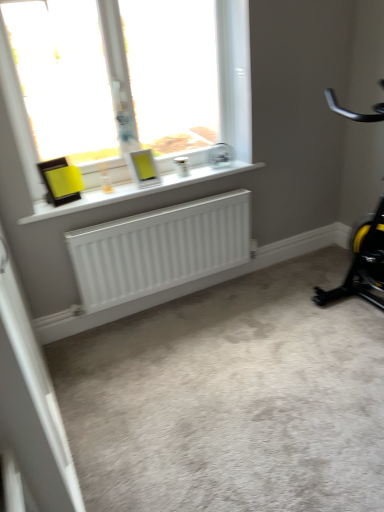
The height and width of the screenshot is (512, 384). Find the location of `white matte radiator at lower center`. white matte radiator at lower center is located at coordinates (136, 190).

This screenshot has height=512, width=384. I want to click on white matte radiator at lower center, so click(x=160, y=249).

The height and width of the screenshot is (512, 384). Describe the element at coordinates (30, 412) in the screenshot. I see `white matte screen door at lower left` at that location.

At what (x,y) coordinates should I click in order to perform the action: click on white matte radiator at lower center. Please return your answer as a coordinate pair (x, y). Looking at the image, I should click on (136, 190).

Is point (73, 134) closer or farther from the camera than point (376, 264)?

Point (73, 134) is closer to the camera than point (376, 264).

Is white plastic window at upper center oriented away from black/yellow plastic stationary bicycle at right?

No, white plastic window at upper center is not facing away from black/yellow plastic stationary bicycle at right.

From the image's perspective, is white plastic window at upper center positioned above or below black/yellow plastic stationary bicycle at right?

Clearly, from the image's perspective, white plastic window at upper center is above black/yellow plastic stationary bicycle at right.

Is white plastic window at upper center in front of or behind black/yellow plastic stationary bicycle at right in the image?

white plastic window at upper center is positioned farther from the viewer than black/yellow plastic stationary bicycle at right.

How far apart are black/yellow plastic stationary bicycle at right and white matte screen door at lower left?

black/yellow plastic stationary bicycle at right and white matte screen door at lower left are 5.28 feet apart from each other.

Is black/yellow plastic stationary bicycle at right to the left of white matte screen door at lower left from the viewer's perspective?

No.

Consider the image. Is white matte screen door at lower left a part of black/yellow plastic stationary bicycle at right?

No, white matte screen door at lower left is located outside of black/yellow plastic stationary bicycle at right.

Considering the relative sizes of black/yellow plastic stationary bicycle at right and white matte screen door at lower left in the image provided, is black/yellow plastic stationary bicycle at right thinner than white matte screen door at lower left?

Incorrect, the width of black/yellow plastic stationary bicycle at right is not less than that of white matte screen door at lower left.

Looking at this image, from the image's perspective, is white plastic window at upper center above or below white matte screen door at lower left?

white plastic window at upper center is above white matte screen door at lower left.

In the scene shown: Which is in front, white plastic window at upper center or white matte screen door at lower left?

Positioned in front is white matte screen door at lower left.

Does white plastic window at upper center contain white matte screen door at lower left?

No, white matte screen door at lower left is not surrounded by white plastic window at upper center.

Can you confirm if black/yellow plastic stationary bicycle at right is positioned to the right of white plastic window at upper center?

Indeed, black/yellow plastic stationary bicycle at right is positioned on the right side of white plastic window at upper center.

What are the coordinates of `stationary bicycle below the white plastic window at upper center (from the image's perspective)` in the screenshot? It's located at (362, 264).

Is black/yellow plastic stationary bicycle at right wider than white plastic window at upper center?

Yes, black/yellow plastic stationary bicycle at right is wider than white plastic window at upper center.

Considering the points (113, 201) and (380, 210), which point is behind, point (113, 201) or point (380, 210)?

The point (380, 210) is more distant.

Looking at this image, can you confirm if white matte radiator at lower center is shorter than black/yellow plastic stationary bicycle at right?

Indeed, white matte radiator at lower center has a lesser height compared to black/yellow plastic stationary bicycle at right.

Does white matte radiator at lower center appear on the right side of black/yellow plastic stationary bicycle at right?

No, white matte radiator at lower center is not to the right of black/yellow plastic stationary bicycle at right.

Looking at this image, are white matte radiator at lower center and white plastic window at upper center making contact?

white matte radiator at lower center and white plastic window at upper center are clearly separated.

Considering the relative positions of white matte radiator at lower center and white plastic window at upper center in the image provided, is white matte radiator at lower center to the left or to the right of white plastic window at upper center?

Based on their positions, white matte radiator at lower center is located to the right of white plastic window at upper center.

Is white matte radiator at lower center inside or outside of white plastic window at upper center?

The correct answer is: outside.

In the scene shown: Are white matte screen door at lower left and white matte radiator at lower center making contact?

They are not placed beside each other.

What's the angular difference between white matte screen door at lower left and white matte radiator at lower center's facing directions?

There is a 88.9-degree angle between the facing directions of white matte screen door at lower left and white matte radiator at lower center.

The image size is (384, 512). In the image, there is a white matte screen door at lower left. Find the location of `radiator above it (from the image's perspective)`. radiator above it (from the image's perspective) is located at coordinates (160, 249).

Identify the location of window above the black/yellow plastic stationary bicycle at right (from the image's perspective). Image resolution: width=384 pixels, height=512 pixels. (125, 83).

This screenshot has height=512, width=384. In order to click on stationary bicycle on the right of white matte screen door at lower left in this screenshot , I will do `click(362, 264)`.

Looking at the image, which one is located further to white matte radiator at lower center, black/yellow plastic stationary bicycle at right or white plastic window at upper center?

black/yellow plastic stationary bicycle at right.

Estimate the real-world distances between objects in this image. Which object is closer to white matte radiator at lower center, white matte radiator at lower center or white matte screen door at lower left?

The object closer to white matte radiator at lower center is white matte radiator at lower center.

When comparing their distances from white plastic window at upper center, does black/yellow plastic stationary bicycle at right or white matte radiator at lower center seem closer?

white matte radiator at lower center is closer to white plastic window at upper center.

Which object lies further to the anchor point black/yellow plastic stationary bicycle at right, white plastic window at upper center or white matte screen door at lower left?

white matte screen door at lower left is positioned further to the anchor black/yellow plastic stationary bicycle at right.

Estimate the real-world distances between objects in this image. Which object is closer to white matte radiator at lower center, black/yellow plastic stationary bicycle at right or white matte screen door at lower left?

black/yellow plastic stationary bicycle at right.

From the image, which object appears to be nearer to white plastic window at upper center, white matte radiator at lower center or black/yellow plastic stationary bicycle at right?

Among the two, white matte radiator at lower center is located nearer to white plastic window at upper center.

When comparing their distances from white matte radiator at lower center, does white matte radiator at lower center or white plastic window at upper center seem further?

The object further to white matte radiator at lower center is white plastic window at upper center.

From the image, which object appears to be nearer to white plastic window at upper center, white matte radiator at lower center or white matte screen door at lower left?

white matte radiator at lower center lies closer to white plastic window at upper center than the other object.

This screenshot has width=384, height=512. In order to click on window sill between white plastic window at upper center and white matte radiator at lower center from top to bottom in this screenshot , I will do `click(136, 190)`.

Image resolution: width=384 pixels, height=512 pixels. Find the location of `radiator between white plastic window at upper center and white matte screen door at lower left from top to bottom`. radiator between white plastic window at upper center and white matte screen door at lower left from top to bottom is located at coordinates (160, 249).

Identify the location of radiator located between white matte radiator at lower center and black/yellow plastic stationary bicycle at right in the left-right direction. The width and height of the screenshot is (384, 512). (160, 249).

At what (x,y) coordinates should I click in order to perform the action: click on window located between white matte screen door at lower left and black/yellow plastic stationary bicycle at right in the left-right direction. Please return your answer as a coordinate pair (x, y). Looking at the image, I should click on (125, 83).